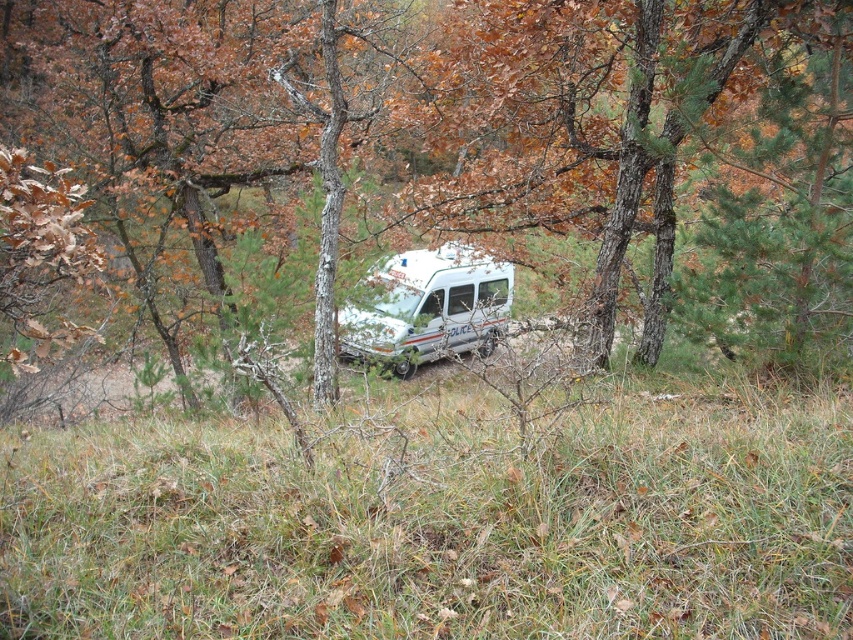
Question: Is green grass at center positioned before white metallic van at center?

Choices:
 (A) no
 (B) yes

Answer: (B)

Question: Is brown bark tree at center thinner than green grass at center?

Choices:
 (A) yes
 (B) no

Answer: (B)

Question: Which object appears farthest from the camera in this image?

Choices:
 (A) white metallic van at center
 (B) brown bark tree at center
 (C) green grass at center

Answer: (A)

Question: Which is farther from the green grass at center?

Choices:
 (A) white metallic van at center
 (B) brown bark tree at center

Answer: (B)

Question: Among these points, which one is nearest to the camera?

Choices:
 (A) (488, 266)
 (B) (496, 589)
 (C) (178, 88)

Answer: (B)

Question: Is the position of green grass at center more distant than that of white metallic van at center?

Choices:
 (A) yes
 (B) no

Answer: (B)